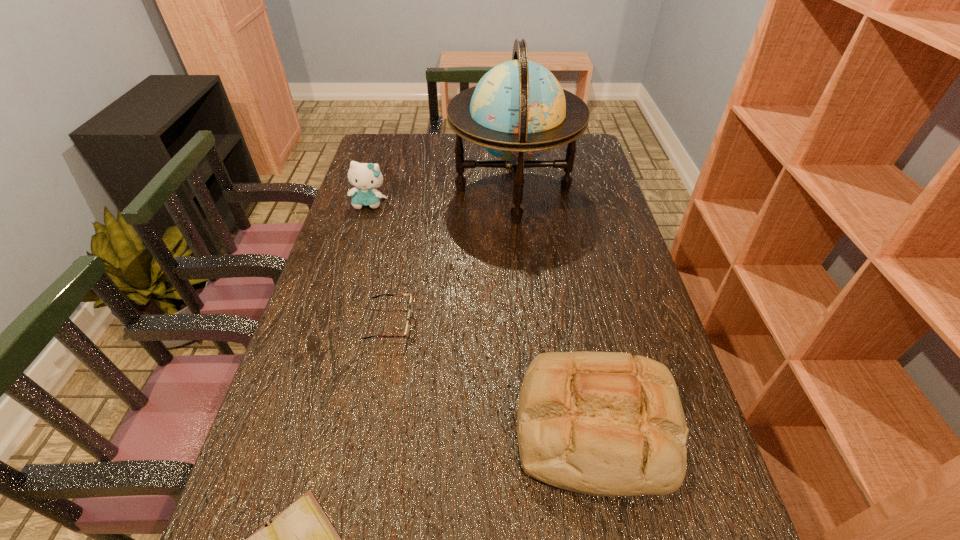
Image resolution: width=960 pixels, height=540 pixels. Identify the location of the tallest object. (518, 110).

This screenshot has height=540, width=960. I want to click on kitten, so click(x=365, y=177).

This screenshot has height=540, width=960. Identify the location of bread. (599, 423).

You are a GUI agent. You are given a task and a screenshot of the screen. Output one action in this format:
    pyautogui.click(x=<x>, y=<y>)
    Task: Click on the third farthest object
    
    Given the screenshot: What is the action you would take?
    pyautogui.click(x=408, y=327)

At what (x,y) coordinates should I click in order to perform the action: click on the fourth tallest object. Please return your answer as a coordinate pair (x, y). Looking at the image, I should click on (408, 327).

The image size is (960, 540). I want to click on free location located on the surface of the globe, so click(x=430, y=189).

Image resolution: width=960 pixels, height=540 pixels. Identify the location of free space located on the surface of the globe. (358, 189).

This screenshot has height=540, width=960. I want to click on vacant area located on the surface of the globe, so click(382, 189).

Image resolution: width=960 pixels, height=540 pixels. I want to click on free space located on the face of the kitten, so click(363, 224).

The image size is (960, 540). What are the coordinates of `free space located on the left of the bread` in the screenshot? It's located at (356, 427).